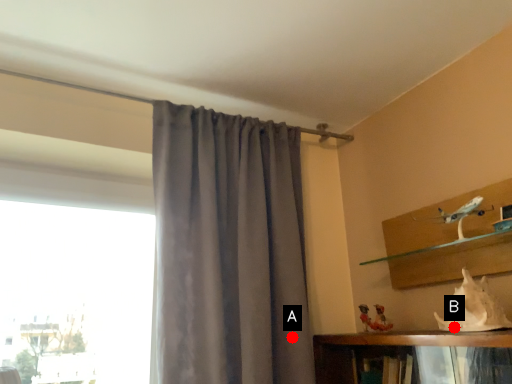
Question: Two points are circled on the image, labeled by A and B beside each circle. Which point is closer to the camera?

Choices:
 (A) A is closer
 (B) B is closer

Answer: (B)